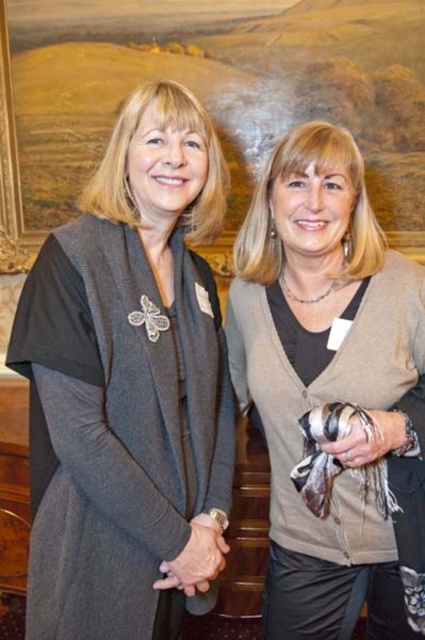
Question: Which point is farther to the camera?

Choices:
 (A) matte gray cardigan at center
 (B) matte gray scarf at center

Answer: (B)

Question: Does matte gray cardigan at center appear under matte gray scarf at center?

Choices:
 (A) no
 (B) yes

Answer: (A)

Question: Which point is closer to the camera?

Choices:
 (A) matte gray scarf at center
 (B) matte gray cardigan at center
 (C) wooden frame at upper center

Answer: (B)

Question: Is matte gray cardigan at center above matte gray scarf at center?

Choices:
 (A) yes
 (B) no

Answer: (A)

Question: Which point appears closest to the camera in this image?

Choices:
 (A) (59, 182)
 (B) (121, 534)
 (C) (333, 436)

Answer: (C)

Question: Is matte gray cardigan at center closer to the viewer compared to wooden frame at upper center?

Choices:
 (A) yes
 (B) no

Answer: (A)